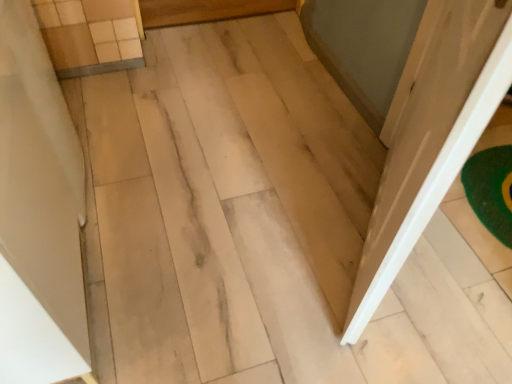
At what (x,y) coordinates should I click in order to perform the action: click on vacant space underneath white wood door at right (from a real-world perspective). Please return your answer as a coordinate pair (x, y). This screenshot has width=512, height=384. Looking at the image, I should click on (358, 229).